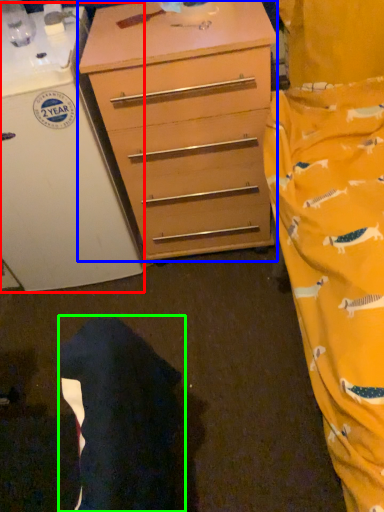
Question: Which object is positioned closest to appliance (highlighted by a red box)? Select from chest of drawers (highlighted by a blue box) and robe (highlighted by a green box).

Choices:
 (A) chest of drawers
 (B) robe

Answer: (A)